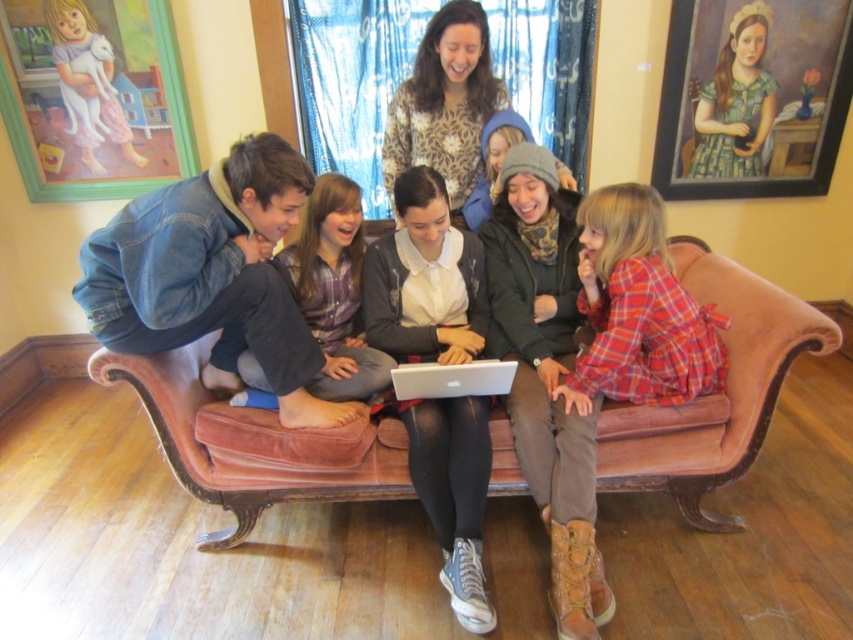
Is the position of denim jacket at left more distant than that of silver metallic laptop at center?

Yes, denim jacket at left is further from the viewer.

Measure the distance between point (x=312, y=237) and camera.

Point (x=312, y=237) is 7.38 feet from camera.

Between point (358, 252) and point (479, 387), which one is positioned behind?

The point (358, 252) is behind.

Where is `denim jacket at left`? denim jacket at left is located at coordinates (334, 291).

Between wooden frame at upper left and silver metallic laptop at center, which one is positioned higher?

wooden frame at upper left is higher up.

Identify the location of wooden frame at upper left. Image resolution: width=853 pixels, height=640 pixels. (38, 164).

Which is in front, point (161, 20) or point (486, 369)?

Point (486, 369) is more forward.

Find the location of a particular element. wooden frame at upper left is located at coordinates (38, 164).

Does pink velvet couch at center appear on the right side of silver metallic laptop at center?

Yes, pink velvet couch at center is to the right of silver metallic laptop at center.

Can you confirm if pink velvet couch at center is shorter than silver metallic laptop at center?

No.

The height and width of the screenshot is (640, 853). I want to click on pink velvet couch at center, so click(x=714, y=396).